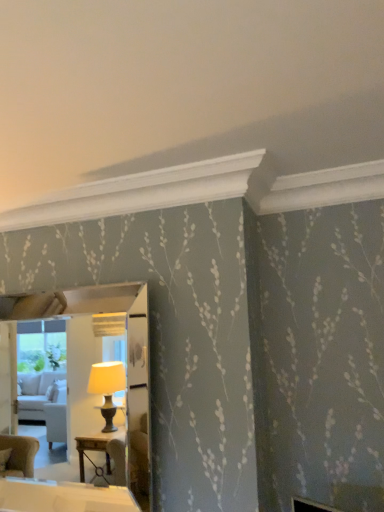
Measure the distance between silver-framed mirror at left and camera.

silver-framed mirror at left and camera are 18.67 feet apart from each other.

Measure the distance between point (115,292) and camera.

Point (115,292) is 6.82 feet from camera.

Describe the element at coordinates (100, 359) in the screenshot. This screenshot has width=384, height=512. I see `silver-framed mirror at left` at that location.

Where is `silver-framed mirror at left`? silver-framed mirror at left is located at coordinates (100, 359).

This screenshot has height=512, width=384. In order to click on silver-framed mirror at left in this screenshot , I will do coord(100,359).